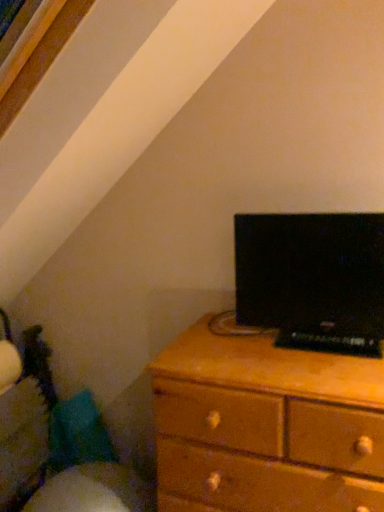
Question: From their relative heights in the image, would you say wooden chest of drawers at lower right is taller or shorter than black glossy monitor at upper right?

Choices:
 (A) tall
 (B) short

Answer: (A)

Question: Is point (322, 429) positioned closer to the camera than point (360, 267)?

Choices:
 (A) closer
 (B) farther

Answer: (A)

Question: Is wooden chest of drawers at lower right in front of or behind black glossy monitor at upper right in the image?

Choices:
 (A) behind
 (B) front

Answer: (B)

Question: Visually, is black glossy monitor at upper right positioned to the left or to the right of wooden chest of drawers at lower right?

Choices:
 (A) left
 (B) right

Answer: (B)

Question: Is black glossy monitor at upper right wider or thinner than wooden chest of drawers at lower right?

Choices:
 (A) wide
 (B) thin

Answer: (B)

Question: From the image's perspective, relative to wooden chest of drawers at lower right, is black glossy monitor at upper right above or below?

Choices:
 (A) below
 (B) above

Answer: (B)

Question: Is black glossy monitor at upper right inside the boundaries of wooden chest of drawers at lower right, or outside?

Choices:
 (A) inside
 (B) outside

Answer: (B)